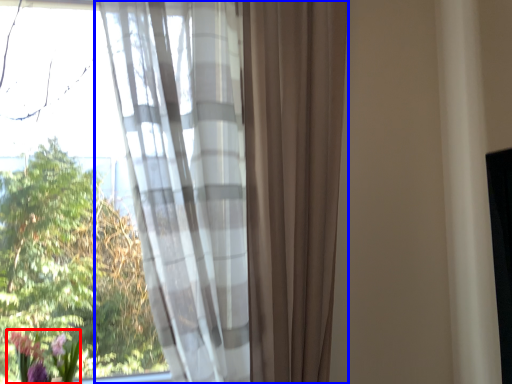
Question: Among these objects, which one is nearest to the camera, floral arrangement (highlighted by a red box) or curtain (highlighted by a blue box)?

Choices:
 (A) floral arrangement
 (B) curtain

Answer: (B)